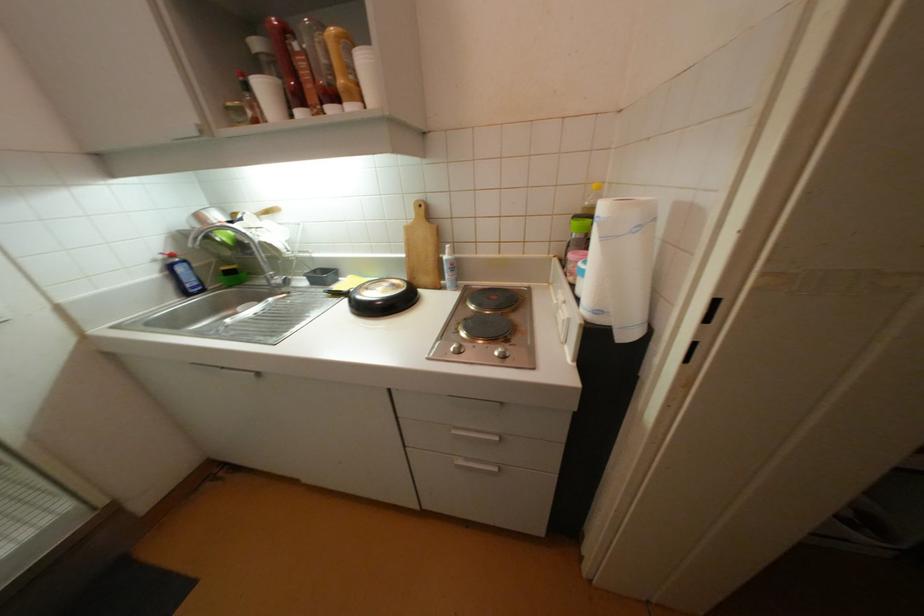
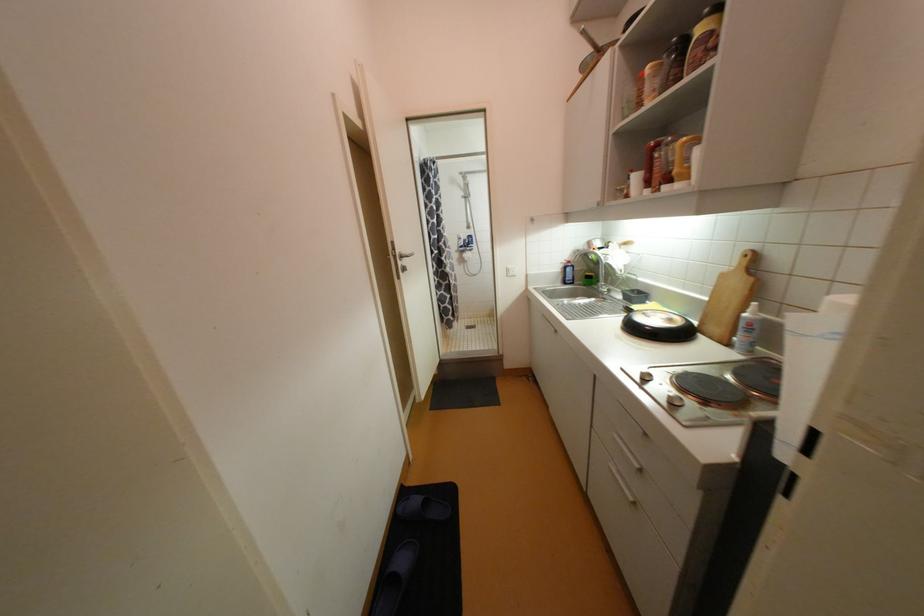
The point at (190, 294) is marked in the first image. Where is the corresponding point in the second image?

(569, 283)